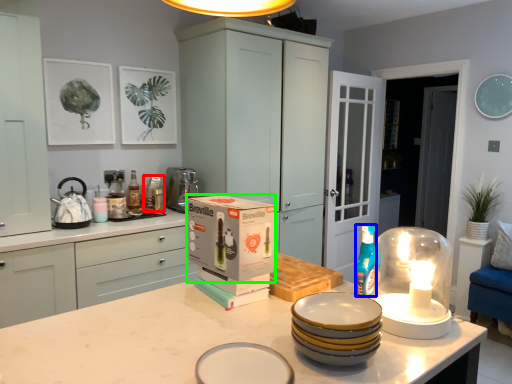
Question: Which is farther away from appliance (highlighted by a red box)? teal (highlighted by a blue box) or cardboard box (highlighted by a green box)?

Choices:
 (A) teal
 (B) cardboard box

Answer: (A)